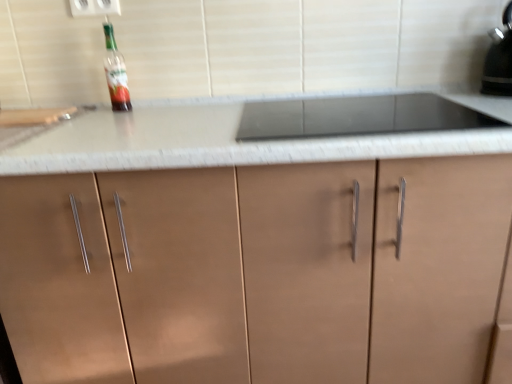
Question: Is white plastic electric outlet at upper center not within translucent glass bottle at upper left?

Choices:
 (A) yes
 (B) no

Answer: (A)

Question: Does white plastic electric outlet at upper center appear on the left side of translucent glass bottle at upper left?

Choices:
 (A) yes
 (B) no

Answer: (A)

Question: Does white plastic electric outlet at upper center come in front of translucent glass bottle at upper left?

Choices:
 (A) no
 (B) yes

Answer: (A)

Question: Is white plastic electric outlet at upper center facing towards translucent glass bottle at upper left?

Choices:
 (A) yes
 (B) no

Answer: (B)

Question: Is white plastic electric outlet at upper center oriented away from translucent glass bottle at upper left?

Choices:
 (A) no
 (B) yes

Answer: (A)

Question: Considering the relative sizes of white plastic electric outlet at upper center and translucent glass bottle at upper left in the image provided, is white plastic electric outlet at upper center taller than translucent glass bottle at upper left?

Choices:
 (A) no
 (B) yes

Answer: (A)

Question: Does matte brown cabinet at center have a greater width compared to white plastic electric outlet at upper center?

Choices:
 (A) no
 (B) yes

Answer: (B)

Question: Considering the relative positions of matte brown cabinet at center and white plastic electric outlet at upper center in the image provided, is matte brown cabinet at center to the right of white plastic electric outlet at upper center from the viewer's perspective?

Choices:
 (A) yes
 (B) no

Answer: (A)

Question: Does matte brown cabinet at center turn towards white plastic electric outlet at upper center?

Choices:
 (A) no
 (B) yes

Answer: (A)

Question: Is matte brown cabinet at center in front of white plastic electric outlet at upper center?

Choices:
 (A) yes
 (B) no

Answer: (A)

Question: Is matte brown cabinet at center taller than white plastic electric outlet at upper center?

Choices:
 (A) no
 (B) yes

Answer: (B)

Question: Does matte brown cabinet at center have a lesser width compared to white plastic electric outlet at upper center?

Choices:
 (A) yes
 (B) no

Answer: (B)

Question: Considering the relative positions of white plastic electric outlet at upper center and black glossy kettle at upper right in the image provided, is white plastic electric outlet at upper center in front of black glossy kettle at upper right?

Choices:
 (A) no
 (B) yes

Answer: (A)